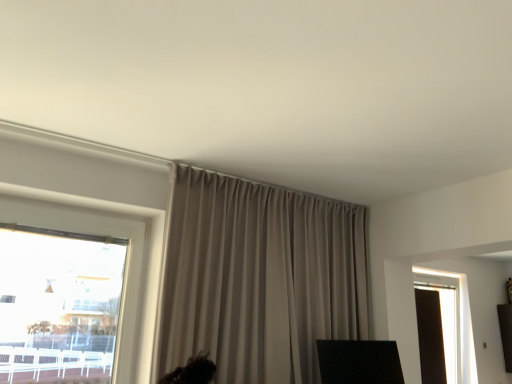
Question: Considering their positions, is matte glass window at right located in front of or behind beige fabric curtain at center?

Choices:
 (A) front
 (B) behind

Answer: (B)

Question: Is matte glass window at right bigger or smaller than beige fabric curtain at center?

Choices:
 (A) small
 (B) big

Answer: (A)

Question: From a real-world perspective, is matte glass window at right above or below beige fabric curtain at center?

Choices:
 (A) below
 (B) above

Answer: (A)

Question: From the image's perspective, relative to matte glass window at right, is beige fabric curtain at center above or below?

Choices:
 (A) below
 (B) above

Answer: (B)

Question: Visually, is beige fabric curtain at center positioned to the left or to the right of matte glass window at right?

Choices:
 (A) left
 (B) right

Answer: (A)

Question: Is beige fabric curtain at center spatially inside matte glass window at right, or outside of it?

Choices:
 (A) outside
 (B) inside

Answer: (A)

Question: From a real-world perspective, is beige fabric curtain at center physically located above or below matte glass window at right?

Choices:
 (A) above
 (B) below

Answer: (A)